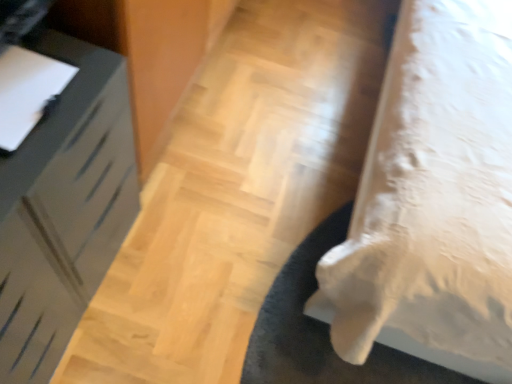
What do you see at coordinates (64, 209) in the screenshot?
I see `white glossy drawer at left, which ranks as the 2th furniture in right-to-left order` at bounding box center [64, 209].

You are a GUI agent. You are given a task and a screenshot of the screen. Output one action in this format:
    pyautogui.click(x=<x>, y=<y>)
    Task: Click on the black fuzzy mat at lower right
    The image size is (512, 384).
    Given the screenshot: What is the action you would take?
    pyautogui.click(x=311, y=359)

Find the location of a particular element. The height and width of the screenshot is (384, 512). white fabric bed at lower right, the second furniture positioned from the left is located at coordinates (433, 200).

At what (x,y) coordinates should I click in order to perform the action: click on white glossy drawer at left, which ranks as the 2th furniture in right-to-left order. Please return your answer as a coordinate pair (x, y). Looking at the image, I should click on (64, 209).

Which is closer, (102, 197) or (465, 308)?

The point (465, 308) is in front.

Can you tell me how much white glossy drawer at left, which ranks as the 2th furniture in right-to-left order, and white fabric bed at lower right, arranged as the first furniture when viewed from the right, differ in facing direction?

white glossy drawer at left, which ranks as the 2th furniture in right-to-left order, and white fabric bed at lower right, arranged as the first furniture when viewed from the right, are facing 88.6 degrees away from each other.

Is white glossy drawer at left, which ranks as the 2th furniture in right-to-left order, taller or shorter than white fabric bed at lower right, arranged as the first furniture when viewed from the right?

Considering their sizes, white glossy drawer at left, which ranks as the 2th furniture in right-to-left order, has less height than white fabric bed at lower right, arranged as the first furniture when viewed from the right.

Consider the image. How distant is white glossy drawer at left, the 1th furniture viewed from the left, from white fabric bed at lower right, the second furniture positioned from the left?

white glossy drawer at left, the 1th furniture viewed from the left, and white fabric bed at lower right, the second furniture positioned from the left, are 30.41 inches apart.

Is white glossy drawer at left, which ranks as the 2th furniture in right-to-left order, behind black fuzzy mat at lower right?

No, the depth of white glossy drawer at left, which ranks as the 2th furniture in right-to-left order, is less than that of black fuzzy mat at lower right.

From the picture: Is white glossy drawer at left, the 1th furniture viewed from the left, positioned beyond the bounds of black fuzzy mat at lower right?

Absolutely, white glossy drawer at left, the 1th furniture viewed from the left, is external to black fuzzy mat at lower right.

Which is in front, point (62, 209) or point (317, 334)?

The point (62, 209) is closer.

In terms of height, does white fabric bed at lower right, arranged as the first furniture when viewed from the right, look taller or shorter compared to white glossy drawer at left, which ranks as the 2th furniture in right-to-left order?

white fabric bed at lower right, arranged as the first furniture when viewed from the right, is taller than white glossy drawer at left, which ranks as the 2th furniture in right-to-left order.

Considering the sizes of white fabric bed at lower right, arranged as the first furniture when viewed from the right, and white glossy drawer at left, which ranks as the 2th furniture in right-to-left order, in the image, is white fabric bed at lower right, arranged as the first furniture when viewed from the right, wider or thinner than white glossy drawer at left, which ranks as the 2th furniture in right-to-left order,?

Considering their sizes, white fabric bed at lower right, arranged as the first furniture when viewed from the right, looks broader than white glossy drawer at left, which ranks as the 2th furniture in right-to-left order.

From the image's perspective, between white fabric bed at lower right, the second furniture positioned from the left, and white glossy drawer at left, the 1th furniture viewed from the left, which one is located above?

white fabric bed at lower right, the second furniture positioned from the left, appears higher in the image.

Identify the location of mat below the white glossy drawer at left, the 1th furniture viewed from the left (from the image's perspective). The image size is (512, 384). (311, 359).

Considering the positions of points (323, 342) and (31, 273), is point (323, 342) closer to camera compared to point (31, 273)?

That is False.

From a real-world perspective, does black fuzzy mat at lower right stand above white glossy drawer at left, the 1th furniture viewed from the left?

No, from a real-world perspective, black fuzzy mat at lower right is not above white glossy drawer at left, the 1th furniture viewed from the left.

Is black fuzzy mat at lower right positioned beyond the bounds of white glossy drawer at left, the 1th furniture viewed from the left?

black fuzzy mat at lower right is positioned outside white glossy drawer at left, the 1th furniture viewed from the left.

Who is more distant, white fabric bed at lower right, arranged as the first furniture when viewed from the right, or black fuzzy mat at lower right?

black fuzzy mat at lower right is more distant.

Measure the distance from white fabric bed at lower right, the second furniture positioned from the left, to black fuzzy mat at lower right.

They are 16.89 inches apart.

Where is `furniture that is the 2nd object above the black fuzzy mat at lower right (from a real-world perspective)`? furniture that is the 2nd object above the black fuzzy mat at lower right (from a real-world perspective) is located at coordinates (433, 200).

Could you tell me if white fabric bed at lower right, arranged as the first furniture when viewed from the right, is turned towards black fuzzy mat at lower right?

No.

Considering the positions of objects black fuzzy mat at lower right and white fabric bed at lower right, arranged as the first furniture when viewed from the right, in the image provided, who is more to the left, black fuzzy mat at lower right or white fabric bed at lower right, arranged as the first furniture when viewed from the right,?

From the viewer's perspective, black fuzzy mat at lower right appears more on the left side.

Is the depth of black fuzzy mat at lower right greater than that of white fabric bed at lower right, arranged as the first furniture when viewed from the right?

Yes.

Is black fuzzy mat at lower right oriented towards white fabric bed at lower right, arranged as the first furniture when viewed from the right?

No, black fuzzy mat at lower right is not facing towards white fabric bed at lower right, arranged as the first furniture when viewed from the right.

Between point (314, 246) and point (382, 298), which one is positioned in front?

Positioned in front is point (382, 298).

Where is `furniture that appears above the white glossy drawer at left, which ranks as the 2th furniture in right-to-left order (from a real-world perspective)`? This screenshot has height=384, width=512. furniture that appears above the white glossy drawer at left, which ranks as the 2th furniture in right-to-left order (from a real-world perspective) is located at coordinates (433, 200).

I want to click on mat that is on the right side of white glossy drawer at left, the 1th furniture viewed from the left, so click(311, 359).

Estimate the real-world distances between objects in this image. Which object is closer to white fabric bed at lower right, the second furniture positioned from the left, black fuzzy mat at lower right or white glossy drawer at left, the 1th furniture viewed from the left?

black fuzzy mat at lower right is positioned closer to the anchor white fabric bed at lower right, the second furniture positioned from the left.

When comparing their distances from white glossy drawer at left, which ranks as the 2th furniture in right-to-left order, does white fabric bed at lower right, the second furniture positioned from the left, or black fuzzy mat at lower right seem further?

The object further to white glossy drawer at left, which ranks as the 2th furniture in right-to-left order, is white fabric bed at lower right, the second furniture positioned from the left.

Considering their positions, is white fabric bed at lower right, arranged as the first furniture when viewed from the right, positioned closer to black fuzzy mat at lower right than white glossy drawer at left, which ranks as the 2th furniture in right-to-left order?

The object closer to black fuzzy mat at lower right is white fabric bed at lower right, arranged as the first furniture when viewed from the right.

Based on their spatial positions, is white glossy drawer at left, the 1th furniture viewed from the left, or black fuzzy mat at lower right further from white fabric bed at lower right, arranged as the first furniture when viewed from the right?

white glossy drawer at left, the 1th furniture viewed from the left, lies further to white fabric bed at lower right, arranged as the first furniture when viewed from the right, than the other object.

When comparing their distances from black fuzzy mat at lower right, does white glossy drawer at left, which ranks as the 2th furniture in right-to-left order, or white fabric bed at lower right, arranged as the first furniture when viewed from the right, seem closer?

white fabric bed at lower right, arranged as the first furniture when viewed from the right, is positioned closer to the anchor black fuzzy mat at lower right.

When comparing their distances from white glossy drawer at left, which ranks as the 2th furniture in right-to-left order, does black fuzzy mat at lower right or white fabric bed at lower right, arranged as the first furniture when viewed from the right, seem further?

white fabric bed at lower right, arranged as the first furniture when viewed from the right, is further to white glossy drawer at left, which ranks as the 2th furniture in right-to-left order.

At what (x,y) coordinates should I click in order to perform the action: click on mat situated between white glossy drawer at left, which ranks as the 2th furniture in right-to-left order, and white fabric bed at lower right, arranged as the first furniture when viewed from the right, from left to right. Please return your answer as a coordinate pair (x, y). Looking at the image, I should click on (311, 359).